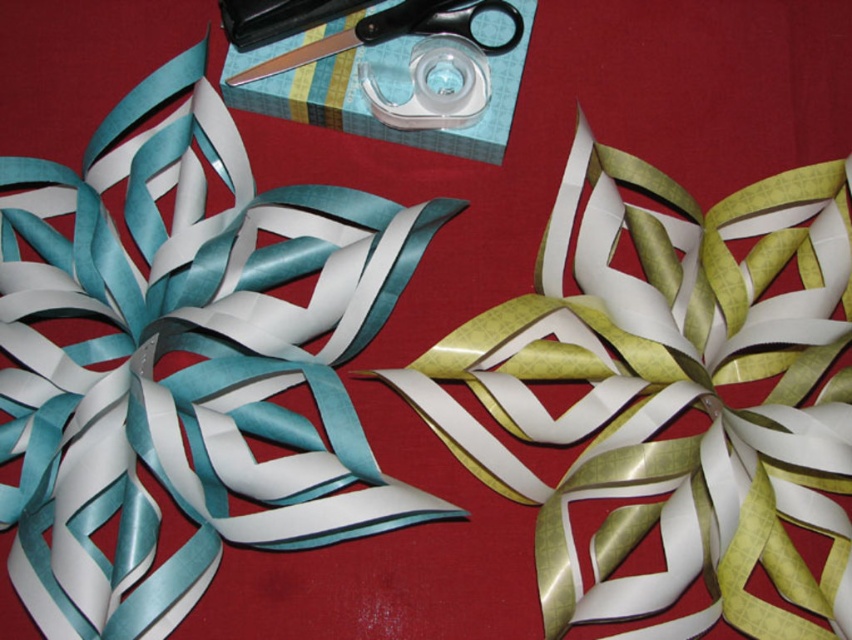
Which is behind, point (653, 177) or point (325, 38)?

Point (325, 38)

Between gold shiny ribbon at center and black plastic scissors at upper center, which one appears on the right side from the viewer's perspective?

gold shiny ribbon at center

At what (x,y) coordinates should I click in order to perform the action: click on gold shiny ribbon at center. Please return your answer as a coordinate pair (x, y). This screenshot has height=640, width=852. Looking at the image, I should click on (671, 396).